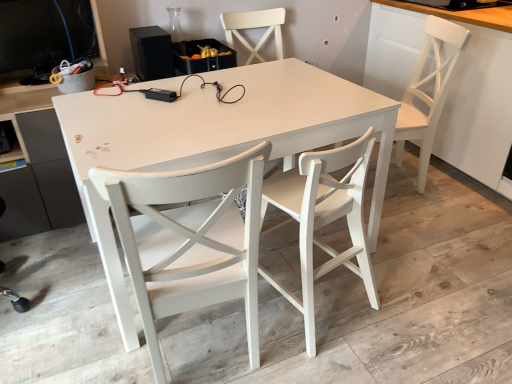
Where is `vacant point to the right of white matte table at center`? This screenshot has height=384, width=512. vacant point to the right of white matte table at center is located at coordinates (438, 268).